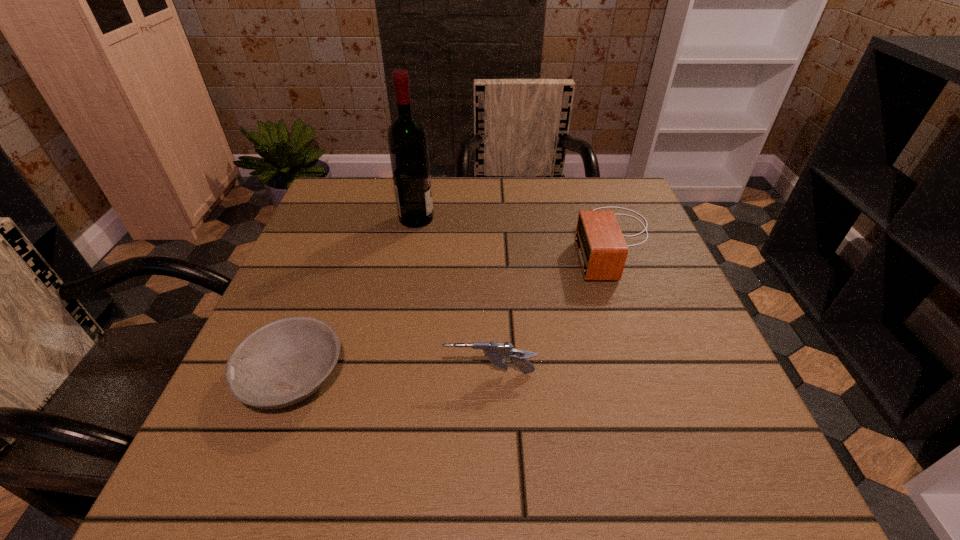
Identify the location of blank space located at the barrel of the second object from right to left. The width and height of the screenshot is (960, 540). (373, 373).

This screenshot has width=960, height=540. Find the location of `free location located 0.080m at the barrel of the second object from right to left`. free location located 0.080m at the barrel of the second object from right to left is located at coordinates (397, 373).

Where is `vacant space located 0.050m at the barrel of the second object from right to left`? vacant space located 0.050m at the barrel of the second object from right to left is located at coordinates (416, 373).

Find the location of a particular element. vacant area situated on the back of the shortest object is located at coordinates (351, 220).

Find the location of a particular element. The image size is (960, 540). alcohol located in the far edge section of the desktop is located at coordinates (407, 139).

What are the coordinates of `radio receiver that is at the far edge` in the screenshot? It's located at (602, 250).

Image resolution: width=960 pixels, height=540 pixels. I want to click on object that is positioned at the left edge, so [x=285, y=361].

Locate an element on the screen. The image size is (960, 540). object at the right edge is located at coordinates 602,250.

I want to click on object that is at the far right corner, so click(x=602, y=250).

This screenshot has height=540, width=960. In the image, there is a desktop. In order to click on vacant space at the far edge in this screenshot , I will do `click(476, 210)`.